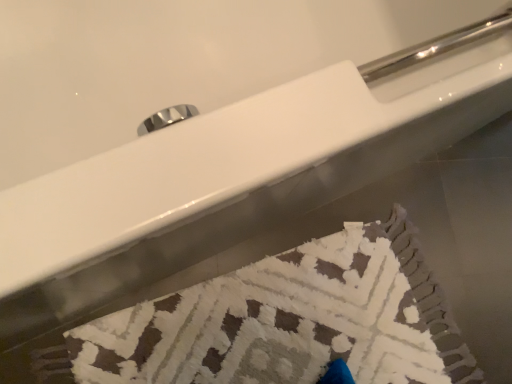
What are the coordinates of `white textured bath towel at lower center` in the screenshot? It's located at (431, 299).

What do you see at coordinates (431, 299) in the screenshot? The width and height of the screenshot is (512, 384). I see `white textured bath towel at lower center` at bounding box center [431, 299].

At what (x,y) coordinates should I click in order to perform the action: click on white textured bath towel at lower center. Please return your answer as a coordinate pair (x, y). Looking at the image, I should click on (431, 299).